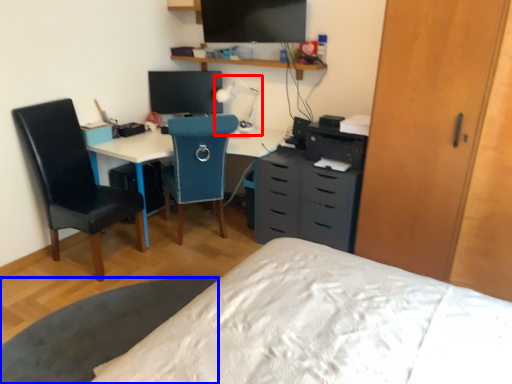
Question: Which object appears farthest to the camera in this image, table lamp (highlighted by a red box) or table (highlighted by a blue box)?

Choices:
 (A) table lamp
 (B) table

Answer: (A)